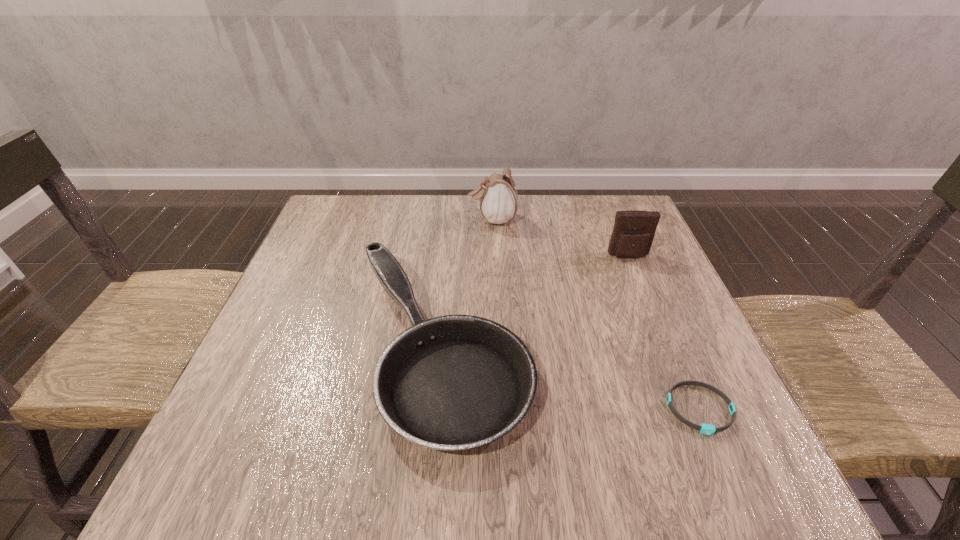
Find the location of a particular element. This screenshot has height=540, width=960. the tallest object is located at coordinates (498, 202).

This screenshot has width=960, height=540. I want to click on the left pouch, so click(x=498, y=202).

Find the location of a particular element. the second tallest object is located at coordinates (634, 230).

I want to click on the second farthest object, so click(x=634, y=230).

This screenshot has height=540, width=960. In order to click on frying pan in this screenshot , I will do `click(456, 382)`.

Where is `wristband`? This screenshot has height=540, width=960. wristband is located at coordinates (707, 429).

Find the location of a particular element. The height and width of the screenshot is (540, 960). vacant point located on the front-facing side of the taller pouch is located at coordinates (407, 219).

I want to click on blank area located 0.310m on the front-facing side of the taller pouch, so click(357, 219).

Locate an element on the screen. blank space located 0.160m on the front-facing side of the taller pouch is located at coordinates (411, 219).

Where is `free space located with an open flap on the shorter pouch`? This screenshot has width=960, height=540. free space located with an open flap on the shorter pouch is located at coordinates (665, 345).